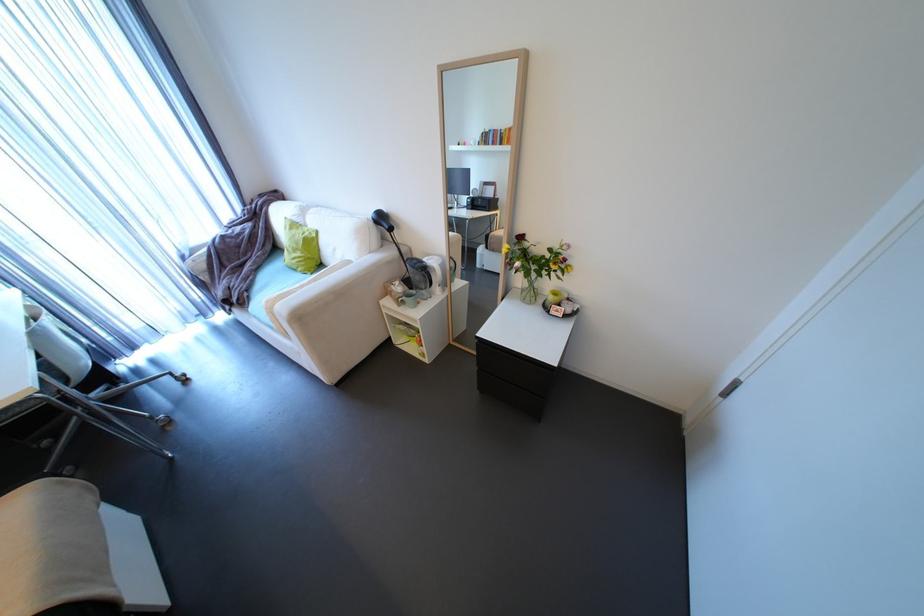
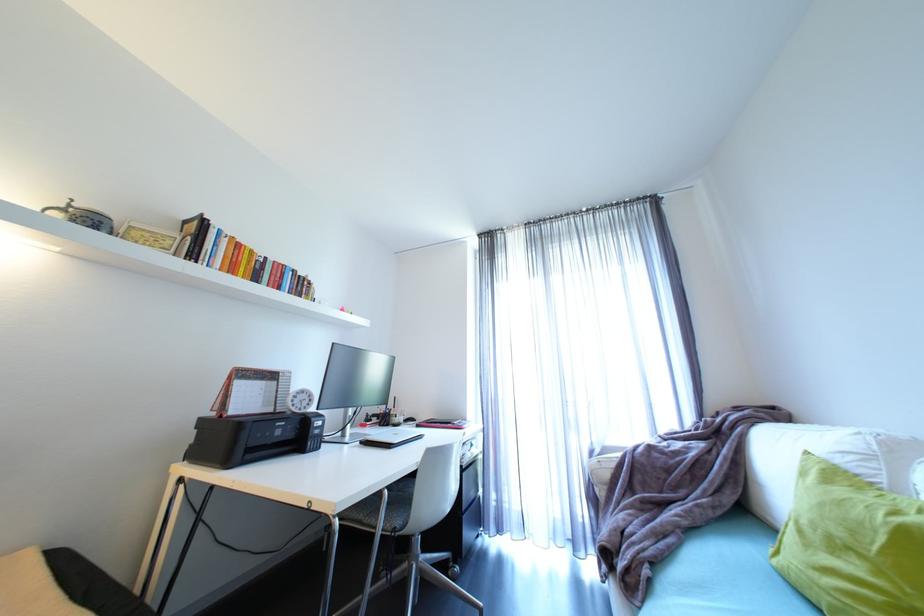
The point at [252,294] is marked in the first image. Where is the corresponding point in the second image?

(653, 572)